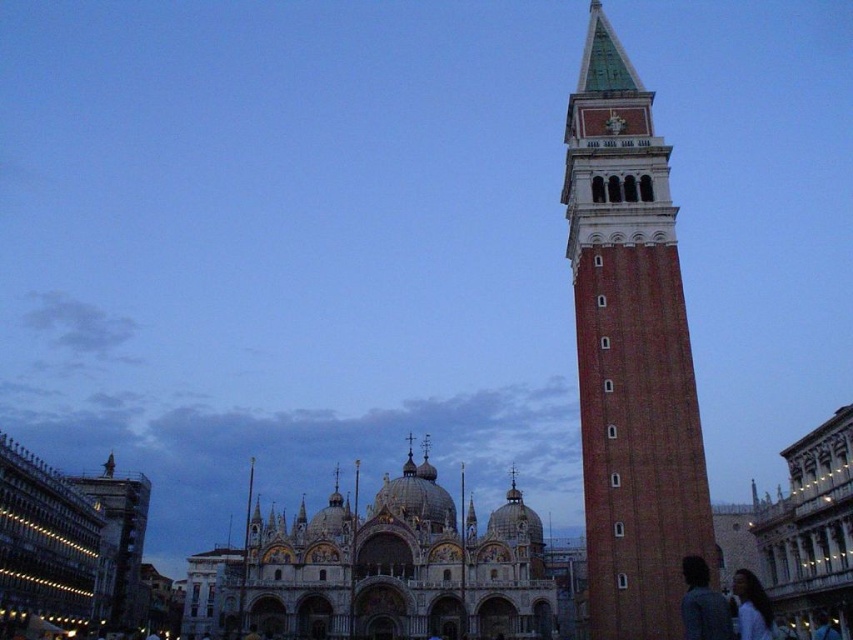
Question: Does dark hair at center lie behind white matte shirt at lower right?

Choices:
 (A) no
 (B) yes

Answer: (A)

Question: Which is farther from the white matte shirt at lower right?

Choices:
 (A) dark hair at center
 (B) brick tower at right
 (C) white marble cathedral at center

Answer: (C)

Question: Is white marble cathedral at center to the right of dark hair at center from the viewer's perspective?

Choices:
 (A) no
 (B) yes

Answer: (A)

Question: Does white marble cathedral at center come behind white matte shirt at lower right?

Choices:
 (A) no
 (B) yes

Answer: (B)

Question: Which is nearer to the white matte shirt at lower right?

Choices:
 (A) brick tower at right
 (B) white marble cathedral at center
 (C) dark hair at center

Answer: (C)

Question: Which point is farther from the camera taking this photo?

Choices:
 (A) (683, 568)
 (B) (610, 484)
 (C) (469, 552)
 (D) (753, 576)

Answer: (C)